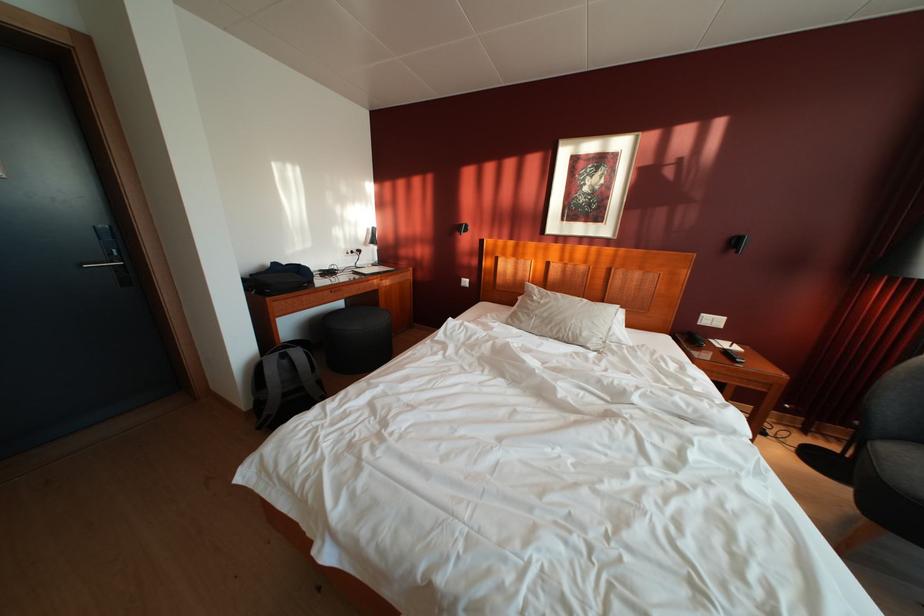
The height and width of the screenshot is (616, 924). What do you see at coordinates (695, 339) in the screenshot?
I see `the telephone handset` at bounding box center [695, 339].